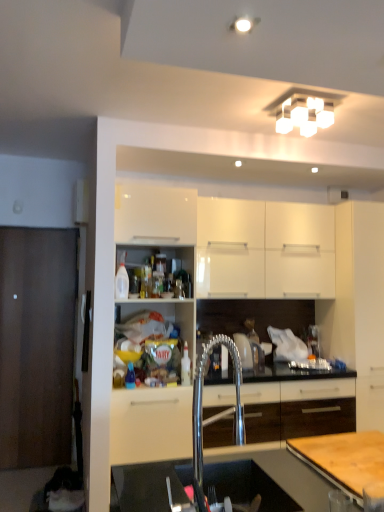
Question: Is white square light fixture at upper center to the left of wooden cutting board at lower right from the viewer's perspective?

Choices:
 (A) no
 (B) yes

Answer: (B)

Question: Is white square light fixture at upper center in contact with wooden cutting board at lower right?

Choices:
 (A) yes
 (B) no

Answer: (B)

Question: Considering the relative sizes of white square light fixture at upper center and wooden cutting board at lower right in the image provided, is white square light fixture at upper center smaller than wooden cutting board at lower right?

Choices:
 (A) yes
 (B) no

Answer: (B)

Question: Would you say wooden cutting board at lower right is part of white square light fixture at upper center's contents?

Choices:
 (A) no
 (B) yes

Answer: (A)

Question: Is white square light fixture at upper center oriented away from wooden cutting board at lower right?

Choices:
 (A) no
 (B) yes

Answer: (A)

Question: From the image's perspective, is white square light fixture at upper center located above wooden cutting board at lower right?

Choices:
 (A) yes
 (B) no

Answer: (A)

Question: Is white square light fixture at upper center located within white glossy cabinet at upper center, the 1th cabinetry positioned from the left?

Choices:
 (A) no
 (B) yes

Answer: (A)

Question: Is white glossy cabinet at upper center, the 1th cabinetry positioned from the left, facing away from white square light fixture at upper center?

Choices:
 (A) yes
 (B) no

Answer: (B)

Question: Can you confirm if white glossy cabinet at upper center, the 1th cabinetry positioned from the left, is shorter than white square light fixture at upper center?

Choices:
 (A) no
 (B) yes

Answer: (A)

Question: Does white glossy cabinet at upper center, the 1th cabinetry positioned from the left, have a smaller size compared to white square light fixture at upper center?

Choices:
 (A) no
 (B) yes

Answer: (A)

Question: Considering the relative positions of white glossy cabinet at upper center, arranged as the 2th cabinetry when viewed from the right, and white square light fixture at upper center in the image provided, is white glossy cabinet at upper center, arranged as the 2th cabinetry when viewed from the right, to the left of white square light fixture at upper center from the viewer's perspective?

Choices:
 (A) no
 (B) yes

Answer: (B)

Question: Is white glossy cabinet at upper center, the 1th cabinetry positioned from the left, in front of white square light fixture at upper center?

Choices:
 (A) no
 (B) yes

Answer: (A)

Question: Is translucent plastic bottle at center, which ranks as the second bottle in left-to-right order, oriented towards white square light fixture at upper center?

Choices:
 (A) yes
 (B) no

Answer: (B)